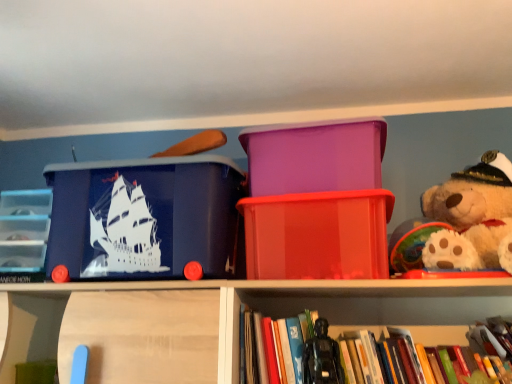
Question: Considering their positions, is black plastic action figure at lower center located in front of or behind translucent red plastic container at center, marked as the 1th storage box in a right-to-left arrangement?

Choices:
 (A) front
 (B) behind

Answer: (A)

Question: Looking at the image, does black plastic action figure at lower center seem bigger or smaller compared to translucent red plastic container at center, the third storage box from the left?

Choices:
 (A) small
 (B) big

Answer: (A)

Question: Estimate the real-world distances between objects in this image. Which object is farther from the translucent red plastic container at center, the third storage box from the left?

Choices:
 (A) clear plastic drawers at left
 (B) hardcover book at center
 (C) purple plastic container at center, the second storage box positioned from the left
 (D) matte blue plastic storage box at left, which is counted as the 3th storage box, starting from the right
 (E) black plastic action figure at lower center

Answer: (A)

Question: Based on their relative distances, which object is farther from the translucent red plastic container at center, the third storage box from the left?

Choices:
 (A) clear plastic drawers at left
 (B) hardcover book at center
 (C) black plastic action figure at lower center
 (D) purple plastic container at center, the second storage box viewed from the right
 (E) matte blue plastic storage box at left, which is counted as the 3th storage box, starting from the right

Answer: (A)